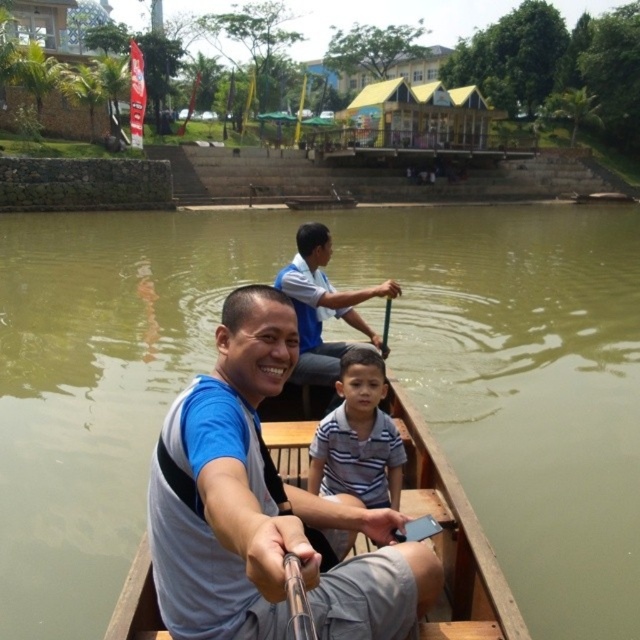
What is the position of the striped cotton shirt at center in the image?

The striped cotton shirt at center is located at point 0.684 on the x axis and 0.561 on the y axis.